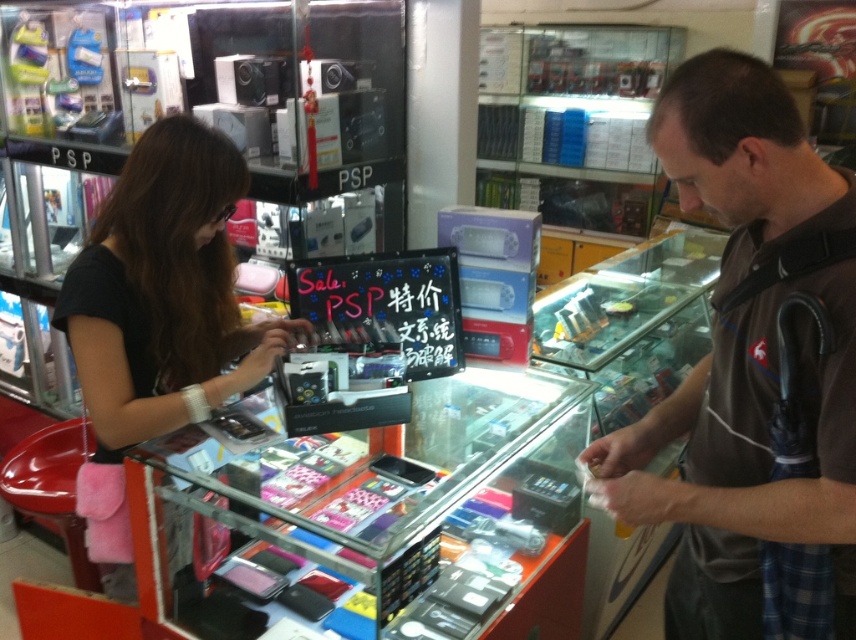
You are a customer in the store and want to pick up both the brown cotton shirt at center and the black matte purse at left. Which item should you reach for first if you want to grab the one closer to your current position?

The black matte purse at left is closer to your current position because the brown cotton shirt at center is located below it, meaning the purse is higher up and thus more accessible without bending down.

You are a customer standing in front of the glass display counter. There are two points marked on the counter. One is at coordinate point (x=755, y=314) and the other is at point (x=191, y=236). Which point is closer to you?

Point (x=755, y=314) is closer to the camera than point (x=191, y=236), so the point at (x=755, y=314) is closer to you.